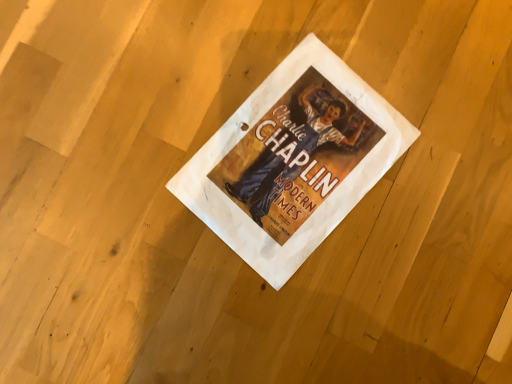
Image resolution: width=512 pixels, height=384 pixels. Describe the element at coordinates (293, 161) in the screenshot. I see `white paper poster at center` at that location.

Locate an element on the screen. Image resolution: width=512 pixels, height=384 pixels. white paper poster at center is located at coordinates (293, 161).

The width and height of the screenshot is (512, 384). In order to click on white paper poster at center in this screenshot , I will do `click(293, 161)`.